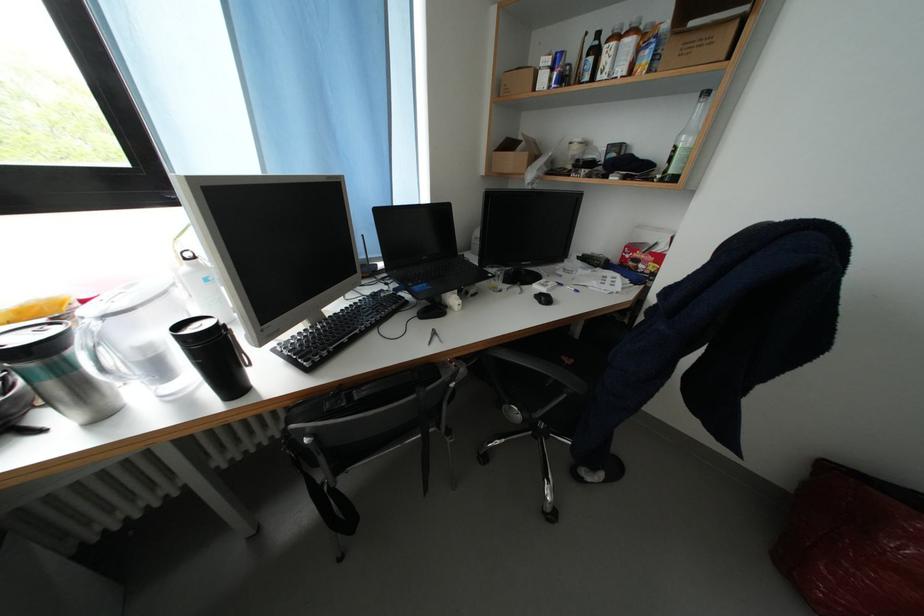
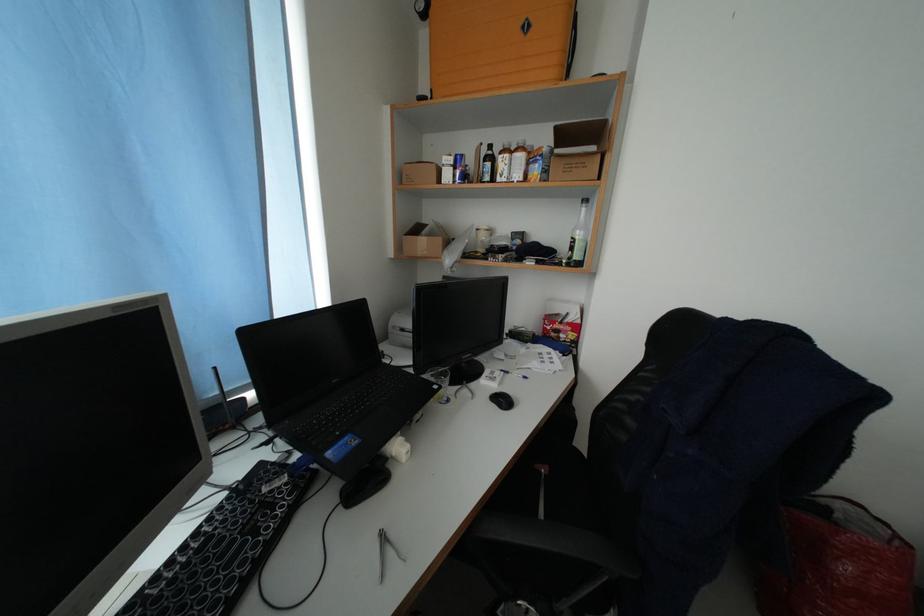
Locate, in the second image, the point that corresponds to [624,265] in the first image.

(546, 338)